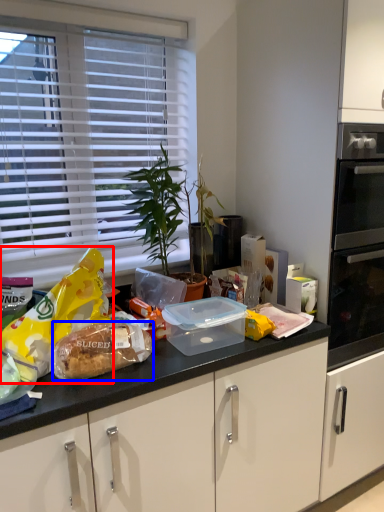
Question: Which point is further to the camera, snack (highlighted by a red box) or food (highlighted by a blue box)?

Choices:
 (A) snack
 (B) food

Answer: (B)